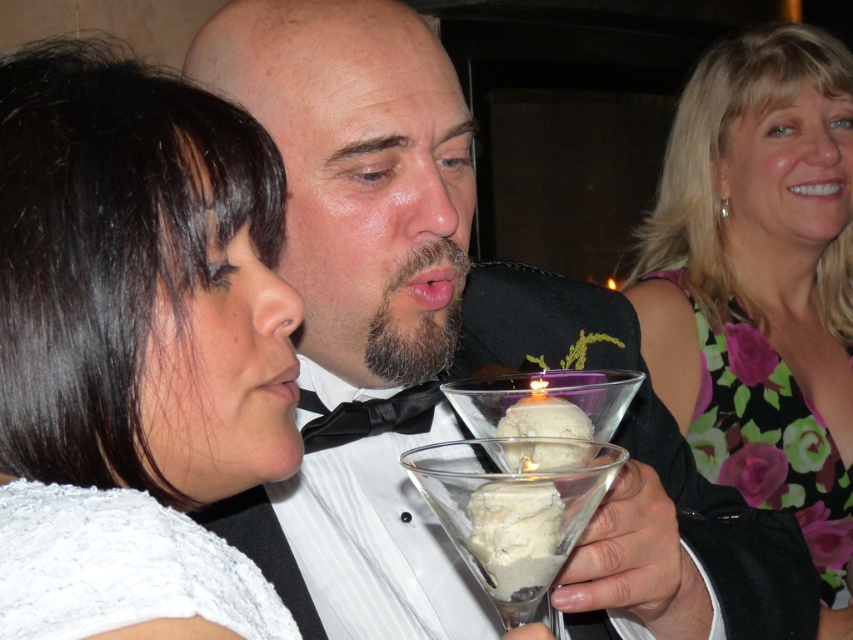
Who is lower down, white lace at left or black satin bow tie at center?

black satin bow tie at center is below.

Does white lace at left come behind black satin bow tie at center?

→ No, white lace at left is closer to the viewer.

I want to click on white lace at left, so click(x=135, y=348).

Is point (48, 339) closer to viewer compared to point (451, 518)?

Yes, it is.

Which is below, white lace at left or clear glass martini glass at center?

clear glass martini glass at center is below.

Identify the location of white lace at left. This screenshot has height=640, width=853. (135, 348).

How distant is white lace at left from white creamy ice cream at center?

The distance of white lace at left from white creamy ice cream at center is 19.78 centimeters.

Can you confirm if white lace at left is smaller than white creamy ice cream at center?

No.

The image size is (853, 640). Describe the element at coordinates (135, 348) in the screenshot. I see `white lace at left` at that location.

I want to click on white lace at left, so click(x=135, y=348).